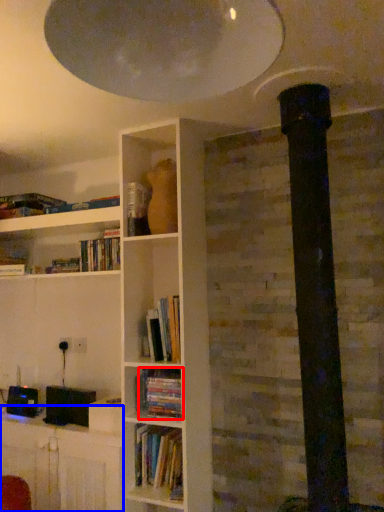
Question: Among these objects, which one is nearest to the camera, book (highlighted by a red box) or table (highlighted by a blue box)?

Choices:
 (A) book
 (B) table

Answer: (B)